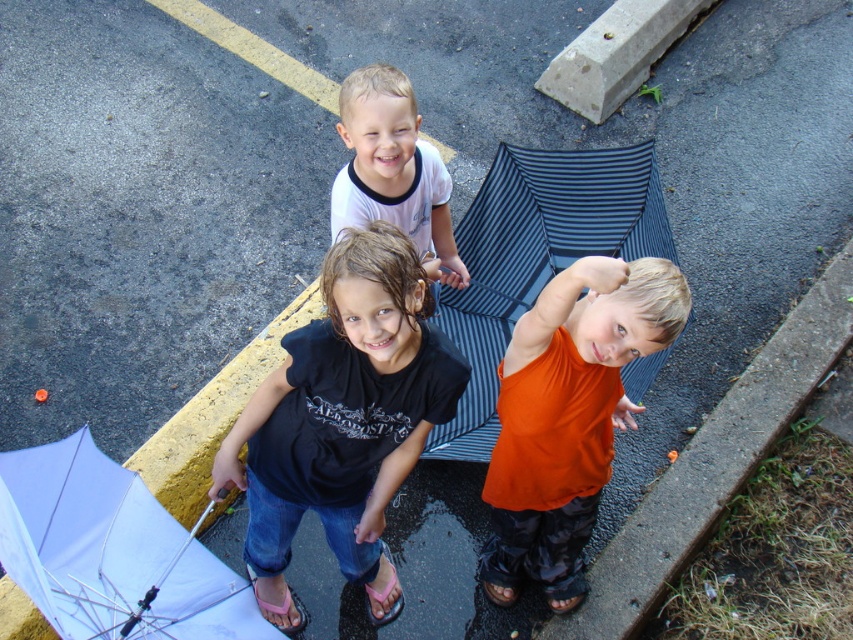
You are a photographer trying to capture a group photo of the black matte shirt at center and the pink fabric sandal at lower center. If you want to ensure both subjects are fully visible in the frame, which subject should you prioritize positioning closer to the camera?

The black matte shirt at center should be positioned closer to the camera since it is wider than the pink fabric sandal at lower center, ensuring both can fit within the frame.